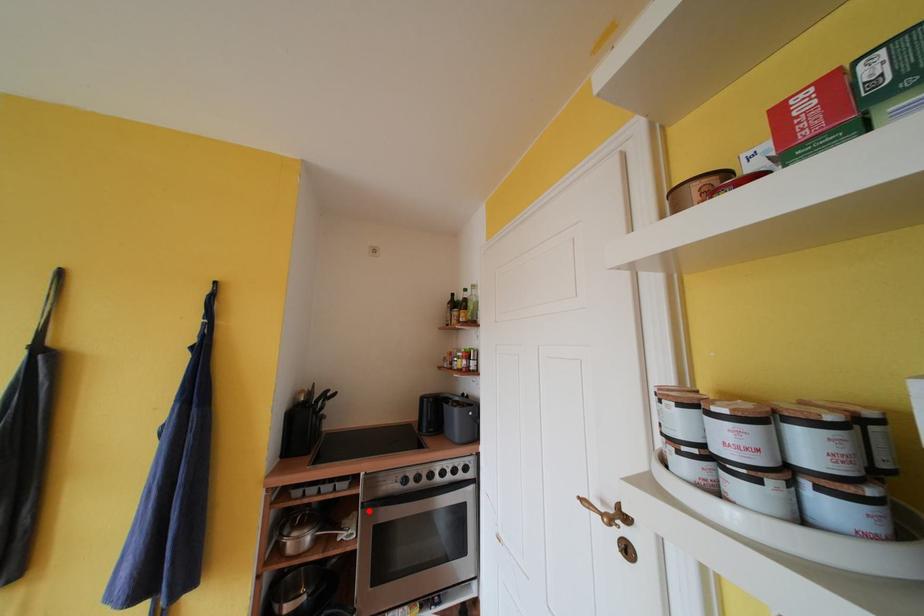
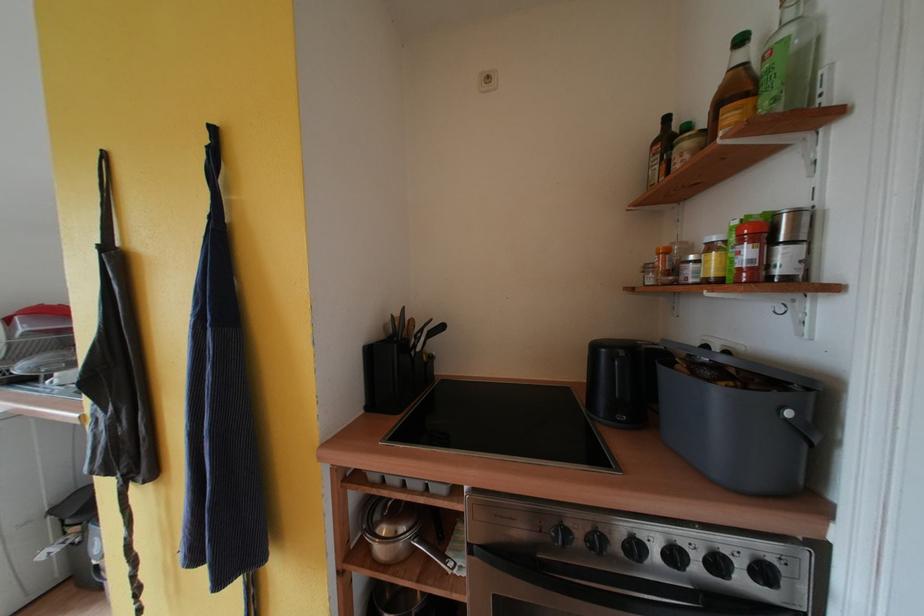
Locate, in the second image, the point that corresponds to the highlighted location in the first image.

(478, 553)